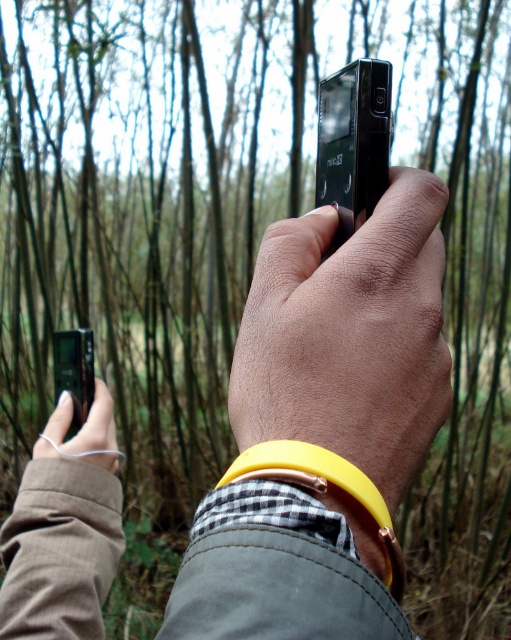
Question: Considering the relative positions of black glossy smartphone at center and matte black camera at lower left in the image provided, where is black glossy smartphone at center located with respect to matte black camera at lower left?

Choices:
 (A) below
 (B) above

Answer: (B)

Question: Which point appears farthest from the camera in this image?

Choices:
 (A) (55, 424)
 (B) (234, 588)
 (C) (88, 369)
 (D) (249, 384)

Answer: (C)

Question: Which object is the farthest from the matte black camera at lower left?

Choices:
 (A) black matte phone at upper center
 (B) black glossy smartphone at center
 (C) yellow rubber band at center

Answer: (A)

Question: Can you confirm if yellow rubber band at center is smaller than matte black smartphone at center?

Choices:
 (A) no
 (B) yes

Answer: (A)

Question: Which of these objects is positioned closest to the matte black smartphone at center?

Choices:
 (A) black matte phone at upper center
 (B) black glossy smartphone at center

Answer: (B)

Question: Is yellow rubber band at center bigger than matte black camera at lower left?

Choices:
 (A) no
 (B) yes

Answer: (B)